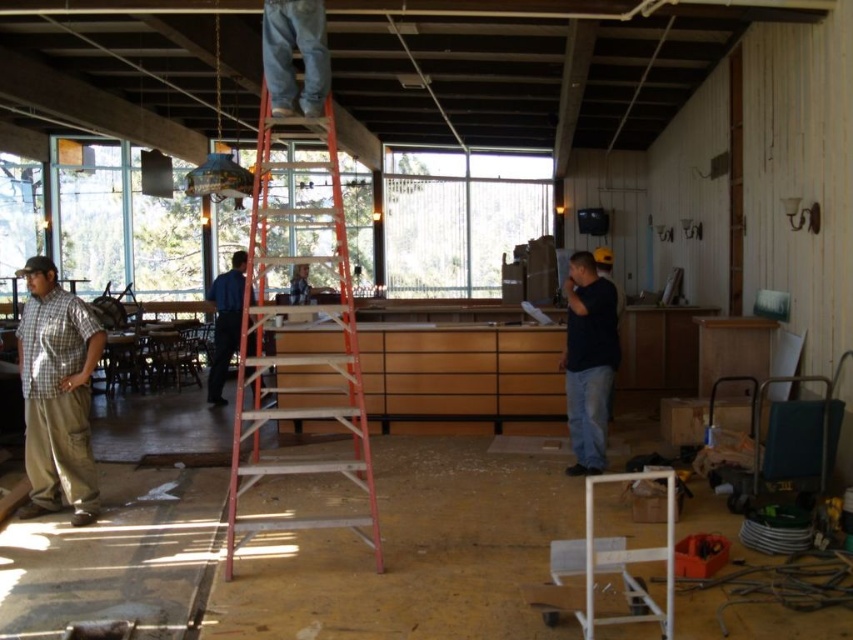
Does point (36, 260) come closer to viewer compared to point (590, 369)?

Yes, it is.

Is checkered fabric shirt at left thinner than dark blue shirt at center?

Incorrect, checkered fabric shirt at left's width is not less than dark blue shirt at center's.

The width and height of the screenshot is (853, 640). What do you see at coordinates (57, 394) in the screenshot?
I see `checkered fabric shirt at left` at bounding box center [57, 394].

The width and height of the screenshot is (853, 640). In order to click on checkered fabric shirt at left in this screenshot , I will do `click(57, 394)`.

Who is shorter, orange metallic ladder at center or dark blue shirt at center?

With less height is orange metallic ladder at center.

Does orange metallic ladder at center appear on the right side of dark blue shirt at center?

In fact, orange metallic ladder at center is to the left of dark blue shirt at center.

Between point (270, 145) and point (607, 339), which one is positioned in front?

Point (607, 339) is in front.

The image size is (853, 640). I want to click on orange metallic ladder at center, so click(x=300, y=348).

Between orange metallic ladder at center and checkered fabric shirt at left, which one is positioned higher?

Positioned higher is orange metallic ladder at center.

Can you confirm if orange metallic ladder at center is shorter than checkered fabric shirt at left?

Correct, orange metallic ladder at center is not as tall as checkered fabric shirt at left.

What do you see at coordinates (300, 348) in the screenshot?
I see `orange metallic ladder at center` at bounding box center [300, 348].

Find the location of a particular element. The height and width of the screenshot is (640, 853). orange metallic ladder at center is located at coordinates click(x=300, y=348).